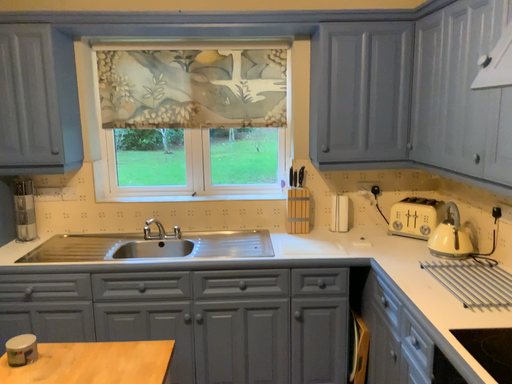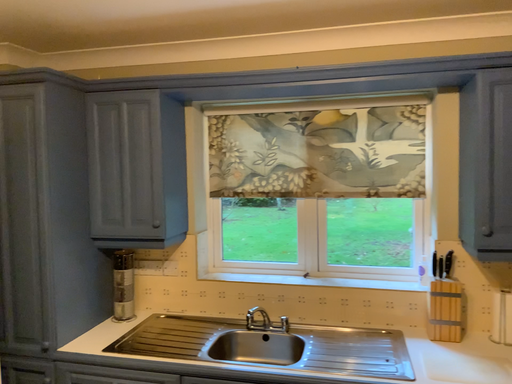
Question: How did the camera likely rotate when shooting the video?

Choices:
 (A) rotated left
 (B) rotated right

Answer: (A)